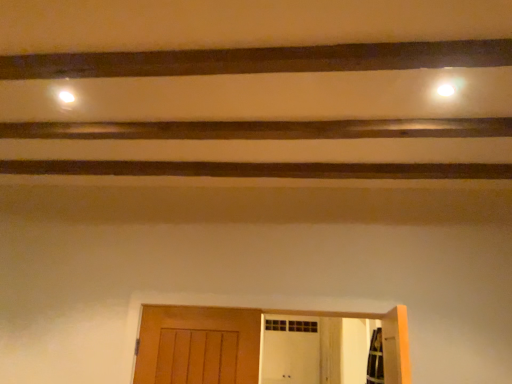
Question: Is brown wooden plank at upper center closer to camera compared to wooden door at lower center?

Choices:
 (A) yes
 (B) no

Answer: (A)

Question: Is brown wooden plank at upper center further to camera compared to wooden door at lower center?

Choices:
 (A) yes
 (B) no

Answer: (B)

Question: Are brown wooden plank at upper center and wooden door at lower center making contact?

Choices:
 (A) no
 (B) yes

Answer: (A)

Question: Is brown wooden plank at upper center looking in the opposite direction of wooden door at lower center?

Choices:
 (A) no
 (B) yes

Answer: (A)

Question: Considering the relative sizes of brown wooden plank at upper center and wooden door at lower center in the image provided, is brown wooden plank at upper center taller than wooden door at lower center?

Choices:
 (A) yes
 (B) no

Answer: (B)

Question: Is wooden door at lower center surrounded by brown wooden plank at upper center?

Choices:
 (A) yes
 (B) no

Answer: (B)

Question: Can you see wooden door at lower center touching brown wooden plank at upper center?

Choices:
 (A) yes
 (B) no

Answer: (B)

Question: Can you confirm if wooden door at lower center is smaller than brown wooden plank at upper center?

Choices:
 (A) no
 (B) yes

Answer: (A)

Question: Is wooden door at lower center not within brown wooden plank at upper center?

Choices:
 (A) no
 (B) yes

Answer: (B)

Question: Does wooden door at lower center have a greater height compared to brown wooden plank at upper center?

Choices:
 (A) no
 (B) yes

Answer: (B)

Question: Is wooden door at lower center to the right of brown wooden plank at upper center from the viewer's perspective?

Choices:
 (A) no
 (B) yes

Answer: (B)

Question: Is wooden door at lower center further to the viewer compared to brown wooden plank at upper center?

Choices:
 (A) yes
 (B) no

Answer: (A)

Question: From a real-world perspective, is wooden door at lower center above or below brown wooden plank at upper center?

Choices:
 (A) above
 (B) below

Answer: (B)